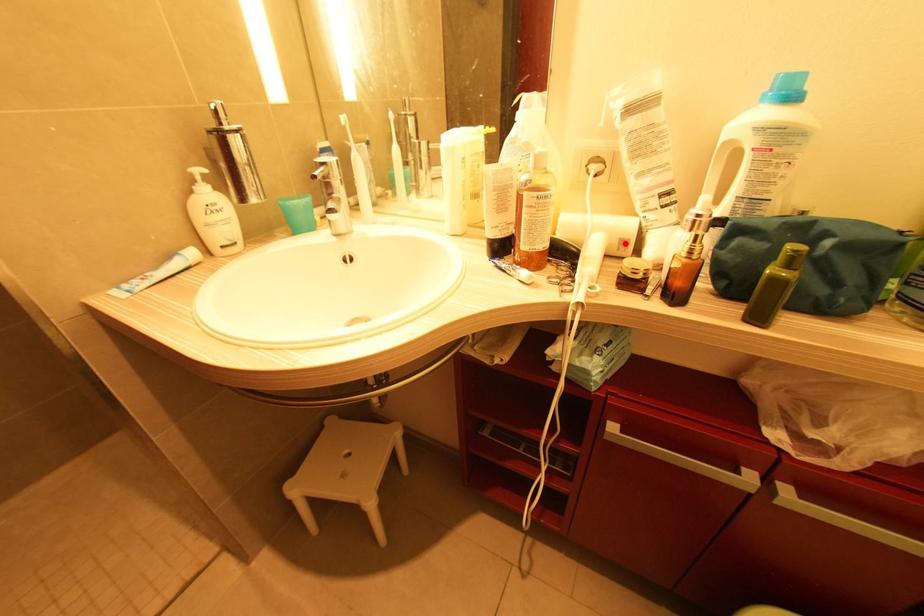
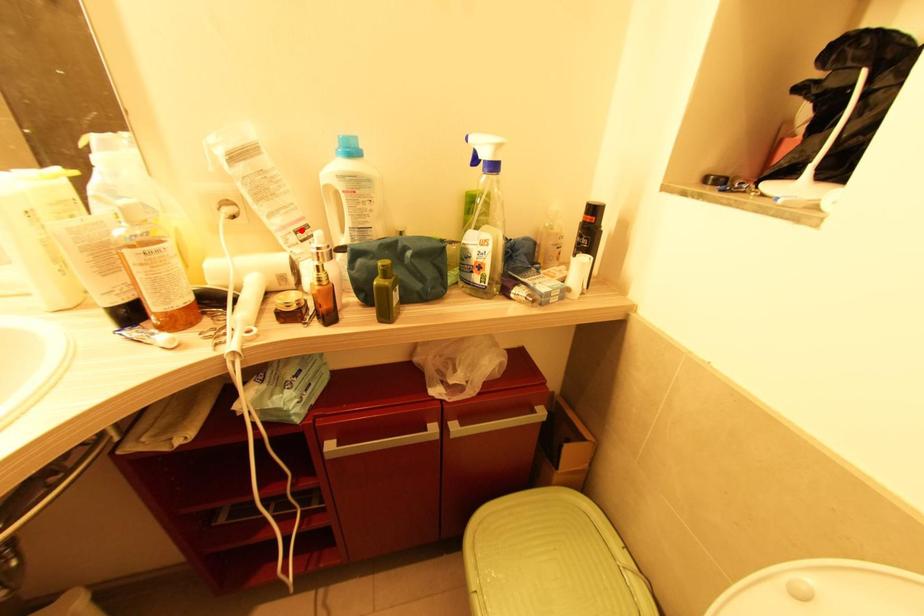
I am providing you with two images of the same scene from different viewpoints. A red point is marked on the first image and another point is marked on the second image. Does the point marked in image1 correspond to the same location as the one in image2?

No